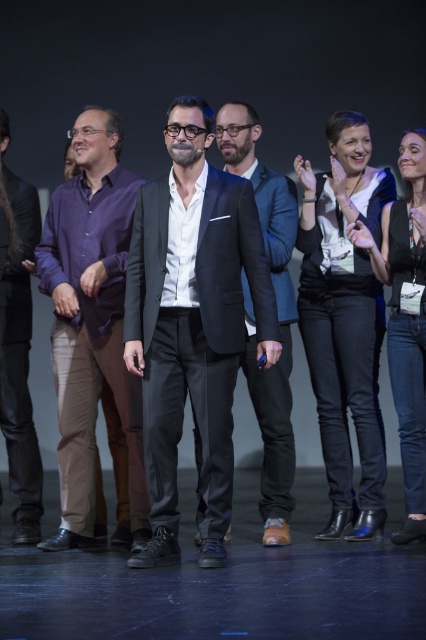
You are organizing a charity event and need to decide which purple shirt to donate. Both the purple cotton shirt at left and the purple fabric shirt at left are available. Which one is larger in size?

The purple cotton shirt at left is bigger than the purple fabric shirt at left, so you should choose the purple cotton shirt at left for donation if you need a larger size.

You are an event organizer arranging a photo shoot for the group on stage. You need to ensure that all participants are visible in the photo. Given the positions and clothing of the purple cotton shirt at left and the black leather jacket at right, which clothing item is taller and might block the view of others if positioned in front?

The purple cotton shirt at left has a greater height compared to the black leather jacket at right, so it might block the view of others if positioned in front.